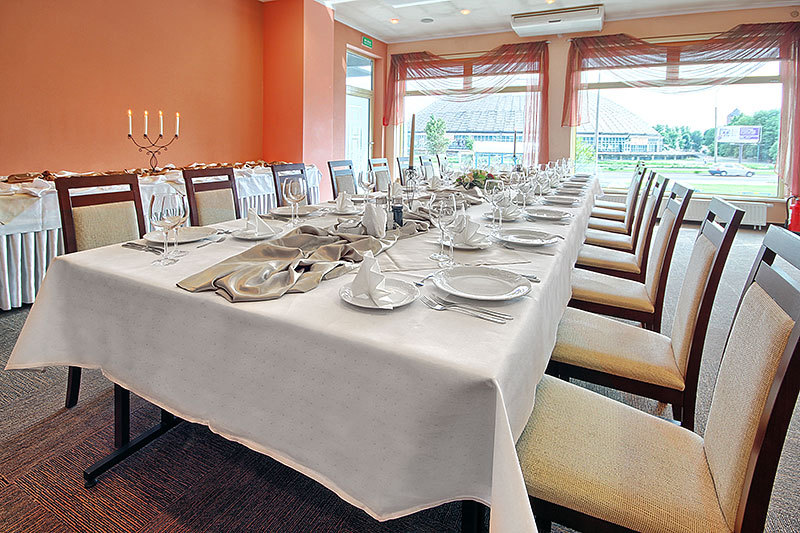
At what (x,y) coordinates should I click in order to perform the action: click on candles. Please return your answer as a coordinate pair (x, y). Looking at the image, I should click on (130, 119), (146, 117), (158, 117), (176, 118).